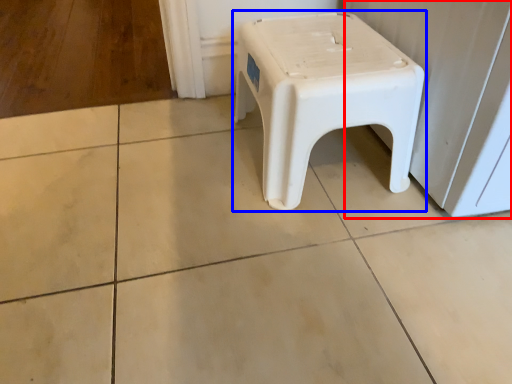
Question: Which of the following is the closest to the observer, screen door (highlighted by a red box) or stool (highlighted by a blue box)?

Choices:
 (A) screen door
 (B) stool

Answer: (A)